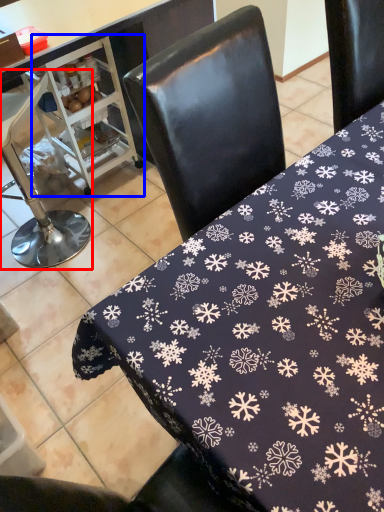
Question: Which of the following is the farthest to the observer, chair (highlighted by a red box) or appliance (highlighted by a blue box)?

Choices:
 (A) chair
 (B) appliance

Answer: (B)